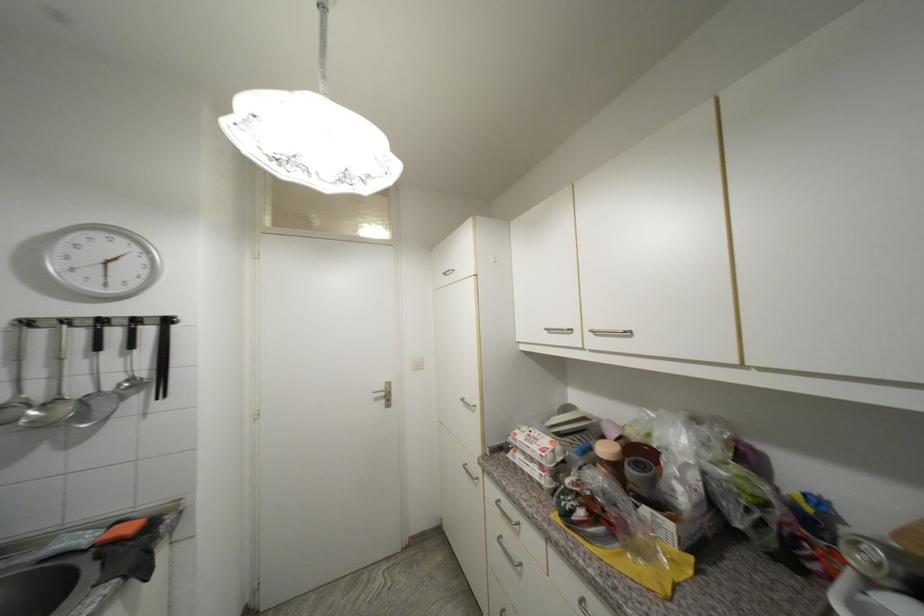
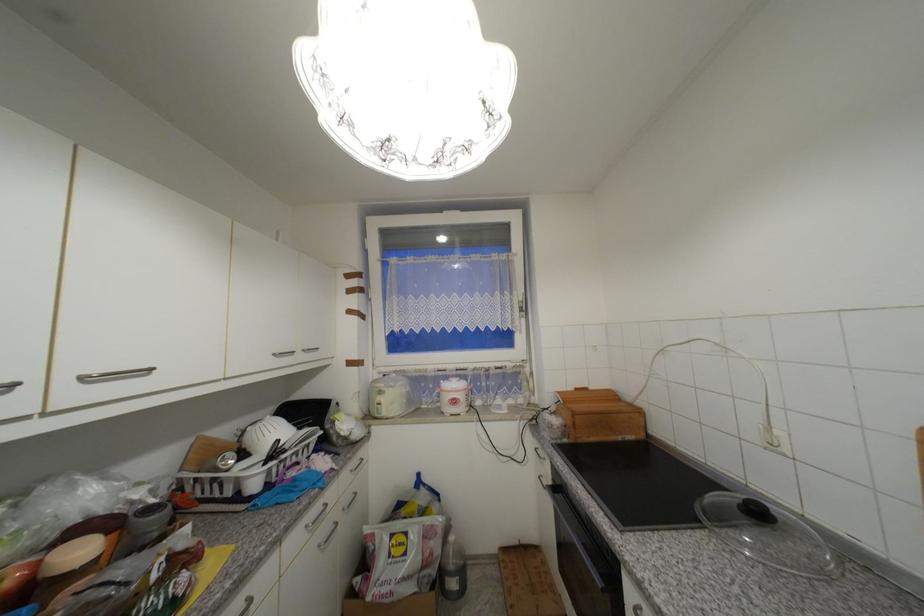
Find the pixel in the second image that matches [578,331] in the first image.

(19, 386)